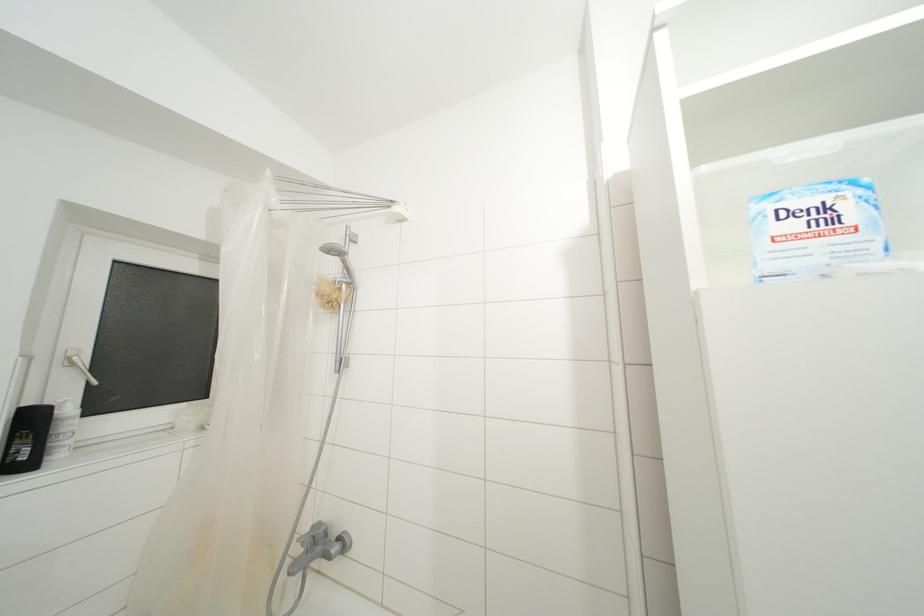
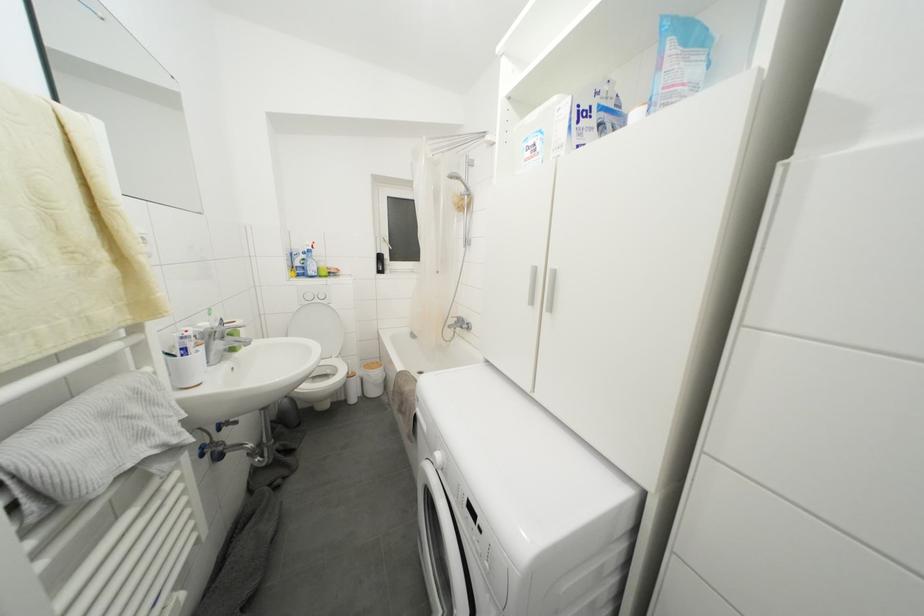
The images are taken continuously from a first-person perspective. In which direction is your viewpoint rotating?

The rotation direction of the camera is left-down.